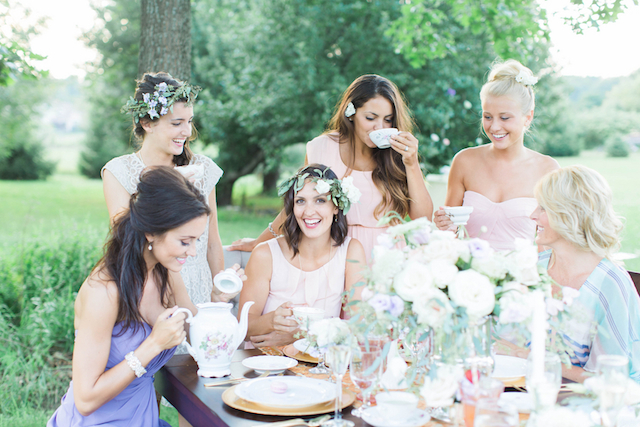
Locate an element on the screen. This screenshot has height=427, width=640. tea cup is located at coordinates (306, 313), (381, 140), (460, 211), (198, 171).